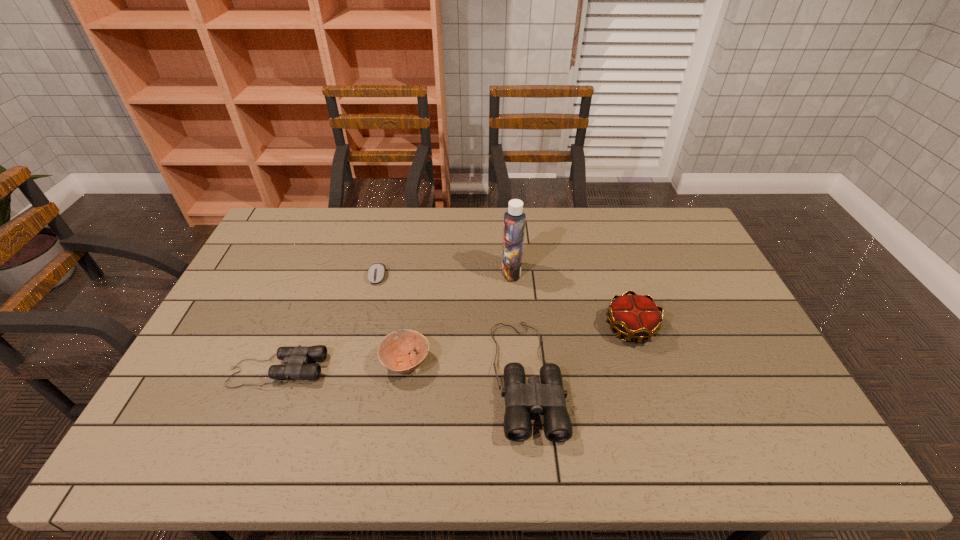
I want to click on free space between the right binoculars and the fourth tallest object, so click(467, 369).

Identify the location of unoccupied position between the taller binoculars and the second shortest object. This screenshot has width=960, height=540. (402, 374).

The height and width of the screenshot is (540, 960). I want to click on unoccupied area between the tallest object and the taller binoculars, so click(519, 324).

Identify which object is located as the fourth nearest to the crown. Please provide its 2D coordinates. Your answer should be formatted as a tuple, i.e. [(x, y)], where the tuple contains the x and y coordinates of a point satisfying the conditions above.

[(376, 272)]

At what (x,y) coordinates should I click in order to perform the action: click on object that is the third closest to the shortest object. Please return your answer as a coordinate pair (x, y). The width and height of the screenshot is (960, 540). Looking at the image, I should click on (548, 397).

Locate an element on the screen. The width and height of the screenshot is (960, 540). vacant region that satisfies the following two spatial constraints: 1. on the wheel side of the second object from left to right; 2. on the left side of the bowl is located at coordinates (356, 362).

The width and height of the screenshot is (960, 540). Find the location of `free space that satisfies the following two spatial constraints: 1. on the back side of the crown; 2. on the left side of the bowl`. free space that satisfies the following two spatial constraints: 1. on the back side of the crown; 2. on the left side of the bowl is located at coordinates (411, 327).

At what (x,y) coordinates should I click in order to perform the action: click on free spot that satisfies the following two spatial constraints: 1. on the wheel side of the rightmost object; 2. on the left side of the computer equipment. Please return your answer as a coordinate pair (x, y). Looking at the image, I should click on (365, 327).